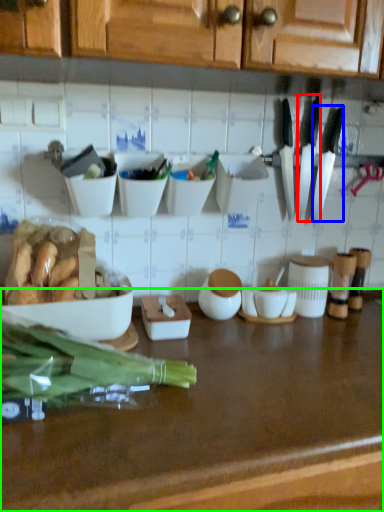
Question: Which object is the farthest from kitchen knife (highlighted by a red box)? Choose among these: kitchen knife (highlighted by a blue box) or countertop (highlighted by a green box).

Choices:
 (A) kitchen knife
 (B) countertop

Answer: (B)